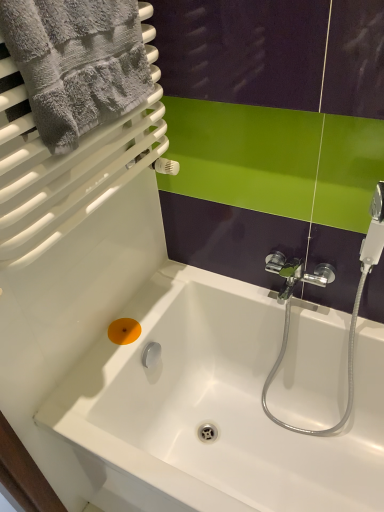
I want to click on free location in front of orange matte soap at lower left, so click(102, 371).